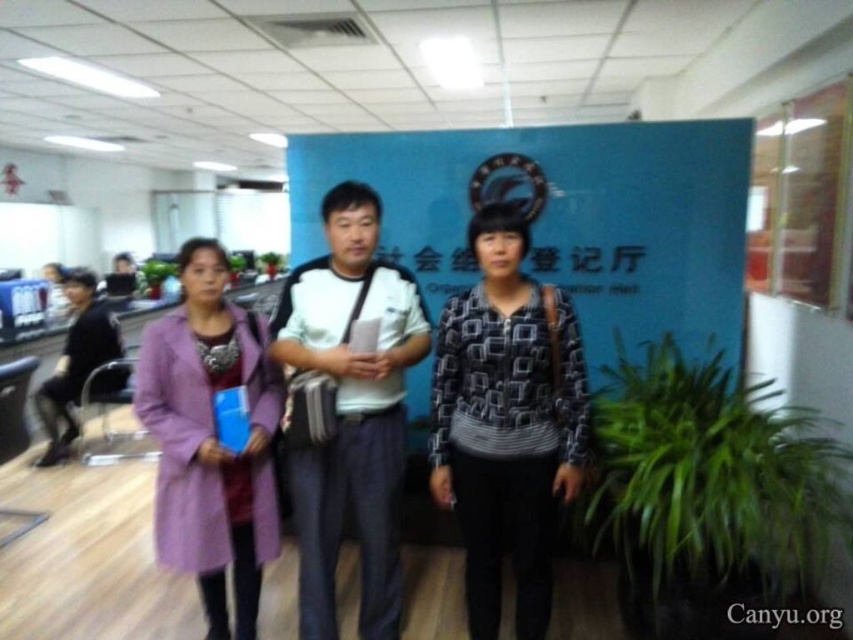
Question: Does patterned fabric jacket at center have a lesser width compared to white cotton shirt at center?

Choices:
 (A) no
 (B) yes

Answer: (B)

Question: Does purple fabric coat at center lie behind patterned fabric jacket at center?

Choices:
 (A) no
 (B) yes

Answer: (B)

Question: Which point is farther to the camera?

Choices:
 (A) (265, 474)
 (B) (570, 307)

Answer: (A)

Question: Can you confirm if patterned fabric jacket at center is thinner than black shirt at left?

Choices:
 (A) no
 (B) yes

Answer: (B)

Question: Based on their relative distances, which object is nearer to the black shirt at left?

Choices:
 (A) purple wool coat at center
 (B) patterned fabric jacket at center

Answer: (A)

Question: Among these objects, which one is farthest from the camera?

Choices:
 (A) black shirt at left
 (B) purple wool coat at center
 (C) white cotton shirt at center
 (D) patterned fabric jacket at center

Answer: (A)